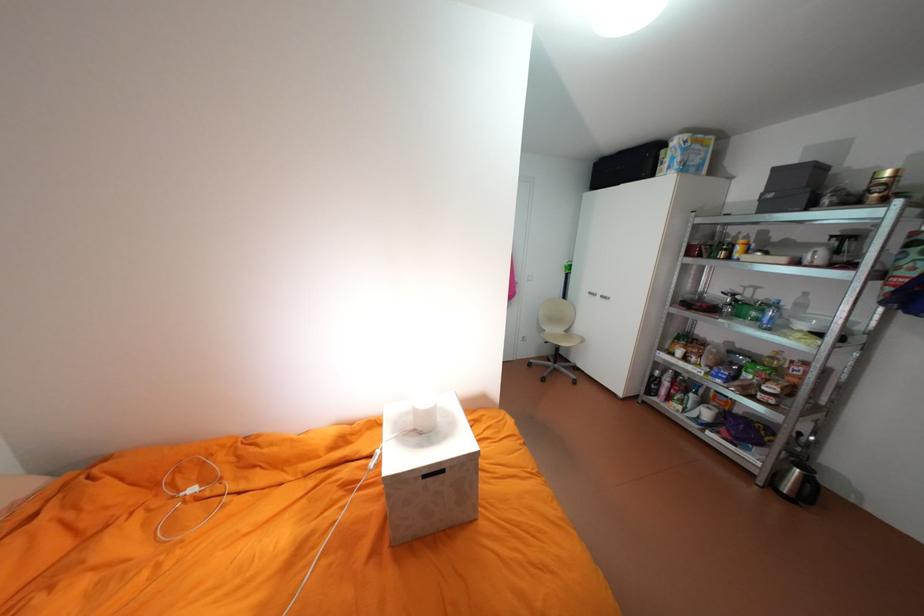
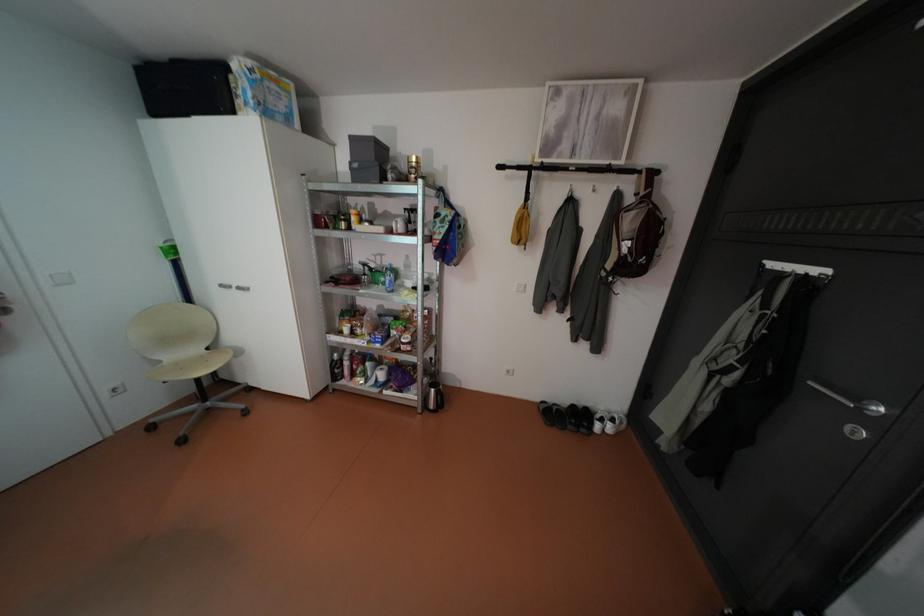
Where in the second image is the point corresponding to point (599, 292) from the first image?

(232, 285)